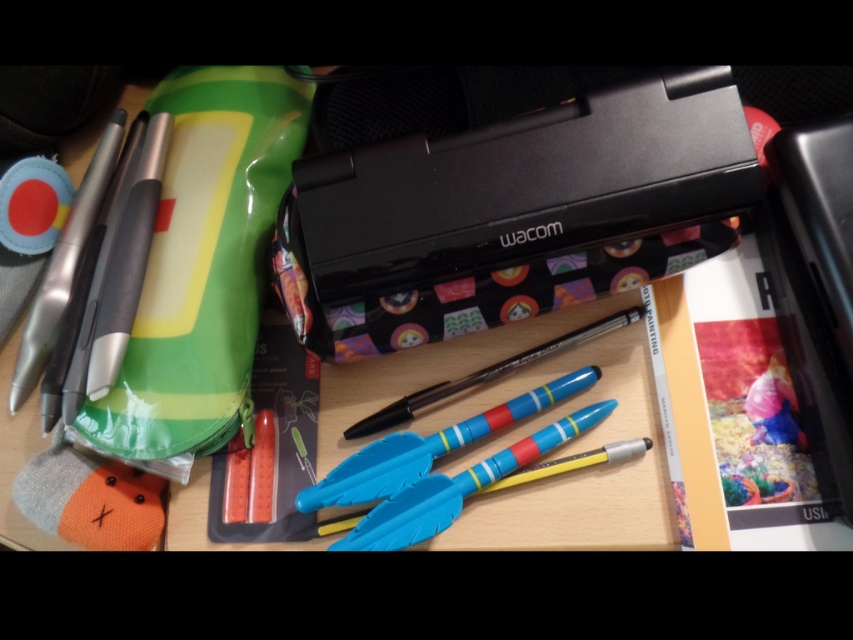
Question: Is black matte wacom case at center above matte plastic pens at center?

Choices:
 (A) no
 (B) yes

Answer: (B)

Question: Considering the real-world distances, which object is closest to the matte plastic pens at center?

Choices:
 (A) translucent plastic pen at center
 (B) black matte wacom case at center

Answer: (A)

Question: Which is farther from the matte plastic pens at center?

Choices:
 (A) translucent plastic pen at center
 (B) black matte wacom case at center

Answer: (B)

Question: Based on their relative distances, which object is nearer to the matte plastic pens at center?

Choices:
 (A) translucent plastic pen at center
 (B) black matte wacom case at center

Answer: (A)

Question: Where is black matte wacom case at center located in relation to matte plastic pens at center in the image?

Choices:
 (A) below
 (B) above

Answer: (B)

Question: Where is matte plastic pens at center located in relation to translucent plastic pen at center in the image?

Choices:
 (A) right
 (B) left

Answer: (B)